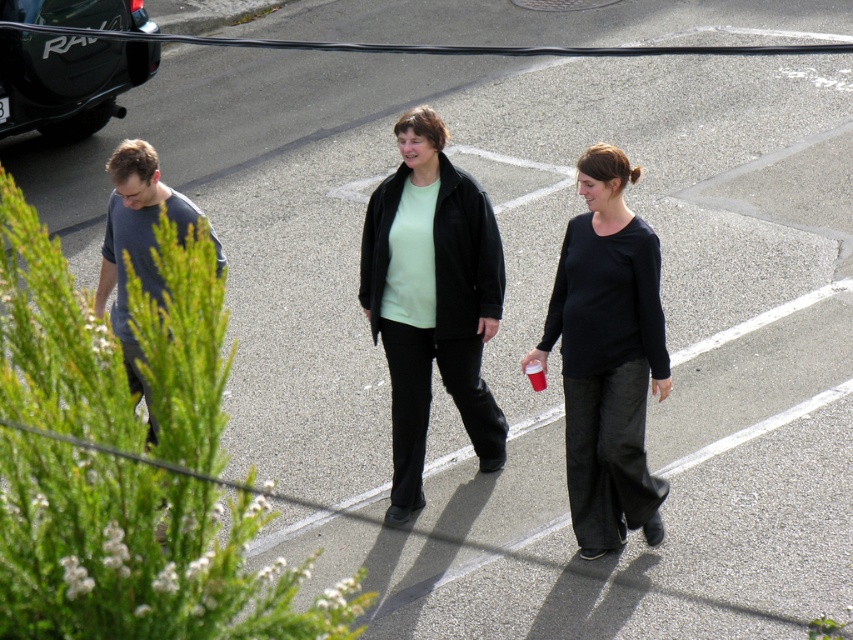
Does matte black jacket at center have a greater width compared to matte black suv at upper left?

In fact, matte black jacket at center might be narrower than matte black suv at upper left.

Is matte black jacket at center to the left of matte black suv at upper left from the viewer's perspective?

In fact, matte black jacket at center is to the right of matte black suv at upper left.

Does point (383, 314) lie in front of point (73, 48)?

Yes, it is in front of point (73, 48).

Where is `matte black jacket at center`? The width and height of the screenshot is (853, 640). matte black jacket at center is located at coordinates (431, 300).

Is point (496, 419) farther from camera compared to point (149, 193)?

Yes, point (496, 419) is farther from viewer.

Between point (450, 285) and point (196, 214), which one is positioned behind?

The point (196, 214) is more distant.

Measure the distance between point (433,132) and camera.

Point (433,132) and camera are 8.76 meters apart from each other.

At what (x,y) coordinates should I click in order to perform the action: click on matte black jacket at center. Please return your answer as a coordinate pair (x, y). Looking at the image, I should click on (431, 300).

Can you confirm if matte black jacket at center is taller than black matte shirt at center?

Yes, matte black jacket at center is taller than black matte shirt at center.

Which is in front, point (451, 216) or point (618, 200)?

Point (618, 200)

Where is `matte black jacket at center`? The image size is (853, 640). matte black jacket at center is located at coordinates (431, 300).